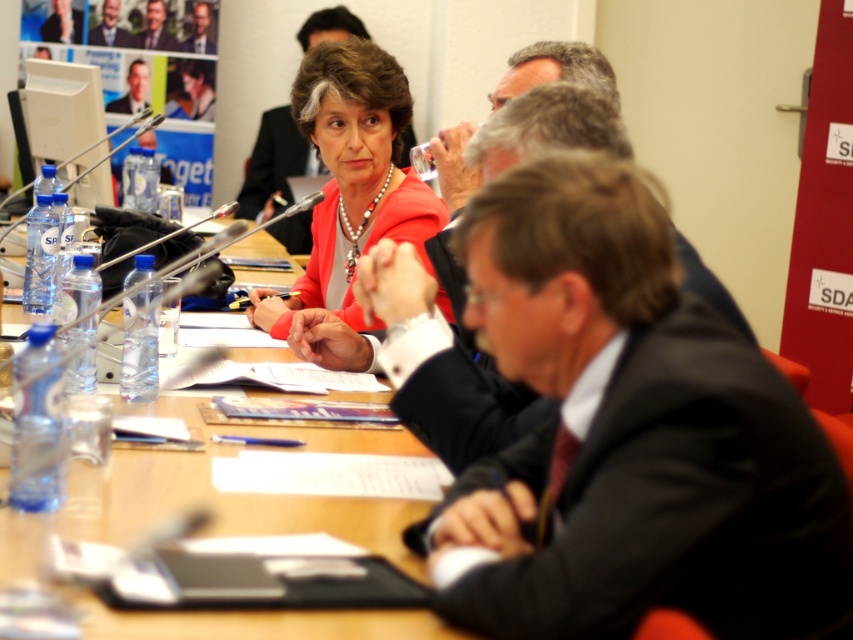
You are attending a meeting and need to locate the person in the dark suit at center. Where should you look relative to the gray hair at upper center?

The dark suit at center is in front of the gray hair at upper center, so you should look towards the front side of the gray hair at upper center to find the person in the dark suit at center.

You are organizing a seating arrangement for a conference table. You have two attendees wearing the dark suit at center and gray hair at upper center. If you want to seat them side by side, which attendee requires more space due to their clothing?

The dark suit at center requires more space because its width is larger than the gray hair at upper center.

You are a photographer setting up for a group photo in this conference room. You want to ensure that the wooden table at center and the smooth gray suit at upper left are both clearly visible in the shot. Considering their heights, which object should be placed closer to the camera to ensure both are visible without one blocking the other?

The wooden table at center has a lesser height compared to smooth gray suit at upper left. To ensure both are visible without blocking, the wooden table at center should be placed closer to the camera so its smaller size doesn not obstruct the taller smooth gray suit at upper left.